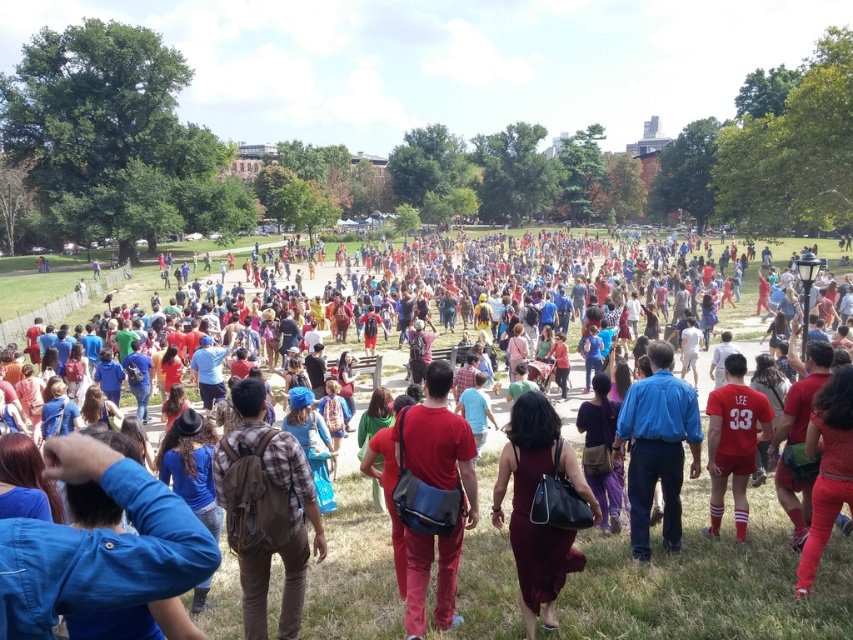
Which of these two, burgundy satin dress at center or blue cotton shirt at center, stands shorter?

Standing shorter between the two is burgundy satin dress at center.

What do you see at coordinates (531, 506) in the screenshot? I see `burgundy satin dress at center` at bounding box center [531, 506].

Does point (544, 538) come farther from viewer compared to point (686, 403)?

That is False.

Locate an element on the screen. The width and height of the screenshot is (853, 640). burgundy satin dress at center is located at coordinates (531, 506).

Which of these two, matte red pants at center or blue cotton shirt at center, stands taller?

blue cotton shirt at center

Does matte red pants at center appear over blue cotton shirt at center?

No, matte red pants at center is not above blue cotton shirt at center.

You are a GUI agent. You are given a task and a screenshot of the screen. Output one action in this format:
    pyautogui.click(x=<x>, y=<y>)
    Task: Click on the matte red pants at center
    
    Given the screenshot: What is the action you would take?
    pyautogui.click(x=438, y=488)

Can you confirm if matte red shirt at center is positioned to the right of matte red pants at center?

Yes, matte red shirt at center is to the right of matte red pants at center.

This screenshot has width=853, height=640. In order to click on matte red shirt at center in this screenshot , I will do `click(706, 579)`.

Measure the distance between matte red shirt at center and camera.

A distance of 54.15 feet exists between matte red shirt at center and camera.

What are the coordinates of `matte red shirt at center` in the screenshot? It's located at (706, 579).